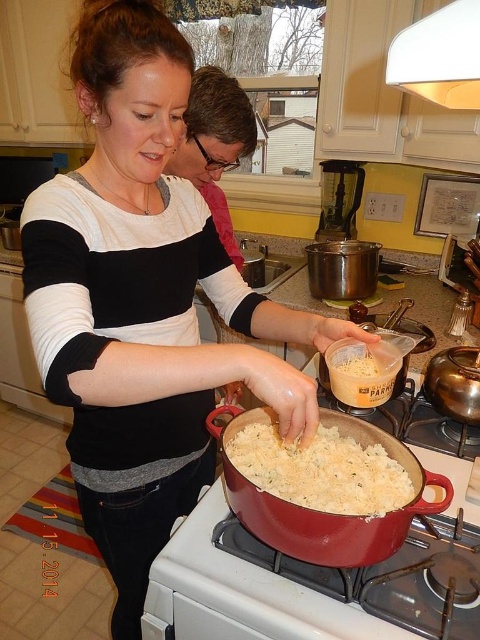
Question: Is white creamy rice at center closer to the viewer compared to white powder container at center?

Choices:
 (A) no
 (B) yes

Answer: (B)

Question: Can you confirm if white creamy rice at center is positioned below white powder container at center?

Choices:
 (A) no
 (B) yes

Answer: (B)

Question: Is white creamy rice at center below white powder container at center?

Choices:
 (A) no
 (B) yes

Answer: (B)

Question: Among these points, which one is farthest from the camera?

Choices:
 (A) (337, 490)
 (B) (384, 369)

Answer: (B)

Question: Which point is farther to the camera?

Choices:
 (A) (292, 490)
 (B) (352, 358)

Answer: (B)